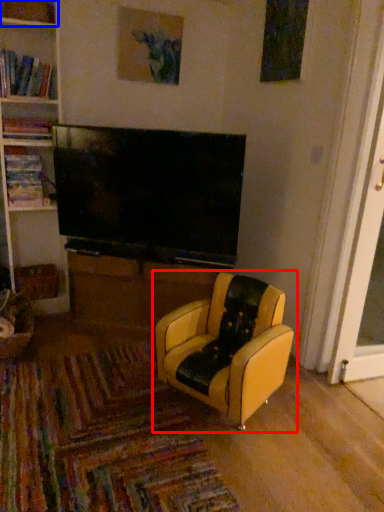
Question: Which of the following is the closest to the observer, chair (highlighted by a red box) or shelf (highlighted by a blue box)?

Choices:
 (A) chair
 (B) shelf

Answer: (A)